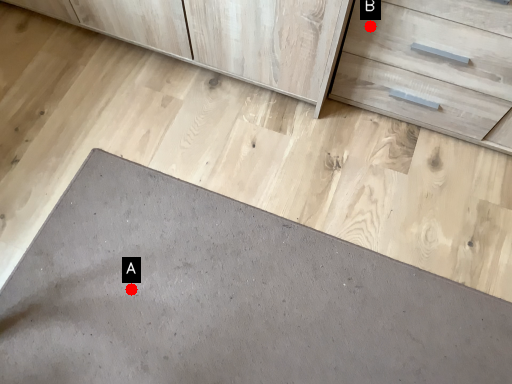
Question: Two points are circled on the image, labeled by A and B beside each circle. Which point is farther from the camera taking this photo?

Choices:
 (A) A is further
 (B) B is further

Answer: (A)